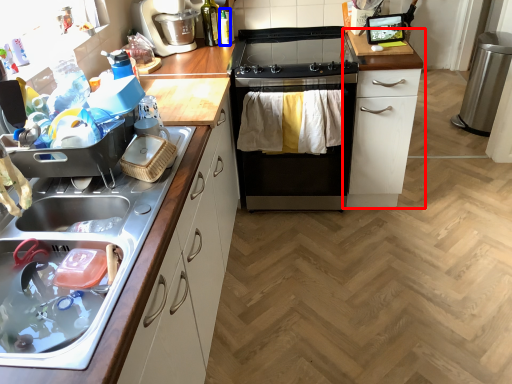
Question: Which point is further to the camera, cabinetry (highlighted by a red box) or bottle (highlighted by a blue box)?

Choices:
 (A) cabinetry
 (B) bottle

Answer: (B)